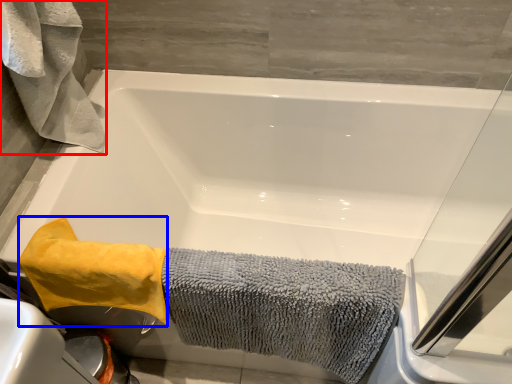
Question: Which point is closer to the camera, bath towel (highlighted by a red box) or bath towel (highlighted by a blue box)?

Choices:
 (A) bath towel
 (B) bath towel

Answer: (A)